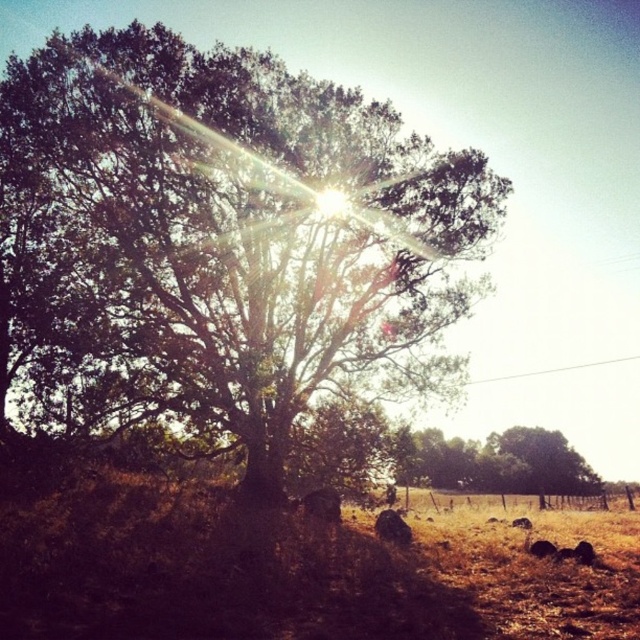
Question: Is green leafy tree at center bigger than green leafy tree at lower right?

Choices:
 (A) no
 (B) yes

Answer: (B)

Question: Which object appears farthest from the camera in this image?

Choices:
 (A) green leafy tree at center
 (B) green leafy tree at lower right

Answer: (B)

Question: Does green leafy tree at center have a lesser width compared to green leafy tree at lower right?

Choices:
 (A) no
 (B) yes

Answer: (A)

Question: Does green leafy tree at center have a lesser width compared to green leafy tree at lower right?

Choices:
 (A) no
 (B) yes

Answer: (A)

Question: Which point is farther to the camera?

Choices:
 (A) green leafy tree at center
 (B) green leafy tree at lower right

Answer: (B)